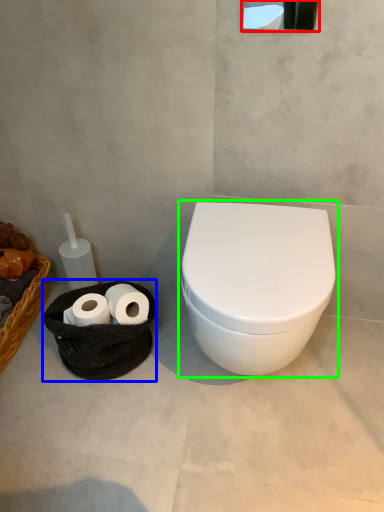
Question: Which is farther away from mirror (highlighted by a red box)? porcelain (highlighted by a blue box) or toilet (highlighted by a green box)?

Choices:
 (A) porcelain
 (B) toilet

Answer: (A)